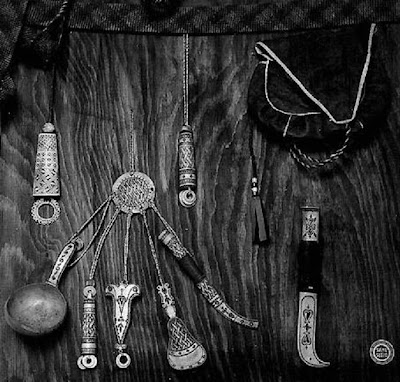
Where is `bowl of spoon`? Image resolution: width=400 pixels, height=382 pixels. bowl of spoon is located at coordinates (36, 310).